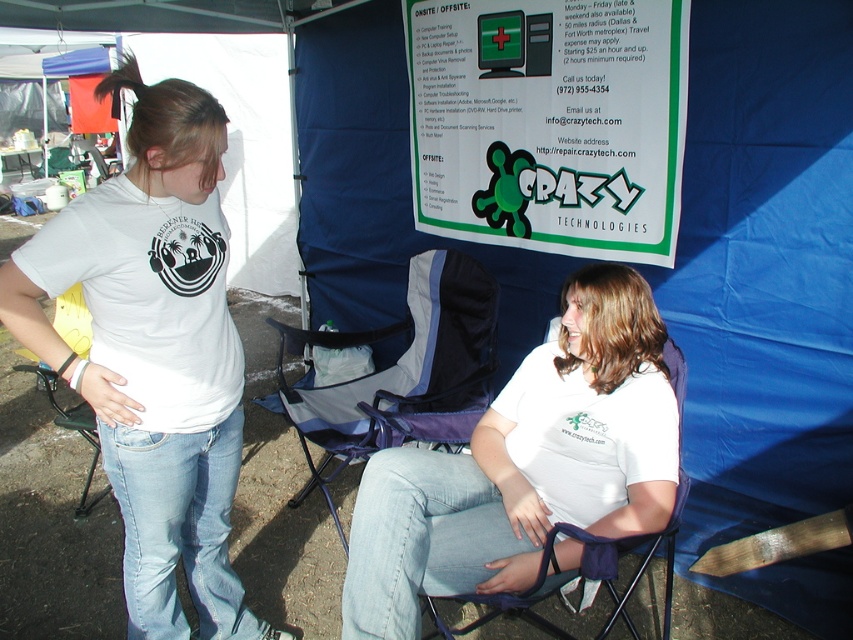
Question: Which point is closer to the camera taking this photo?

Choices:
 (A) (103, 435)
 (B) (190, 248)
 (C) (421, 520)

Answer: (B)

Question: Is the position of white cotton t-shirt at left less distant than that of white cotton shirt at center?

Choices:
 (A) yes
 (B) no

Answer: (A)

Question: Does white cotton t-shirt at left appear under white cotton shirt at center?

Choices:
 (A) no
 (B) yes

Answer: (A)

Question: Among these points, which one is nearest to the camera?

Choices:
 (A) (438, 560)
 (B) (654, 413)
 (C) (117, 90)
 (D) (20, 301)

Answer: (D)

Question: Which of the following is the farthest from the observer?

Choices:
 (A) (86, 310)
 (B) (607, 337)
 (C) (149, 618)

Answer: (A)

Question: Does white matte t-shirt at left have a lesser width compared to blue fabric chair at center?

Choices:
 (A) yes
 (B) no

Answer: (A)